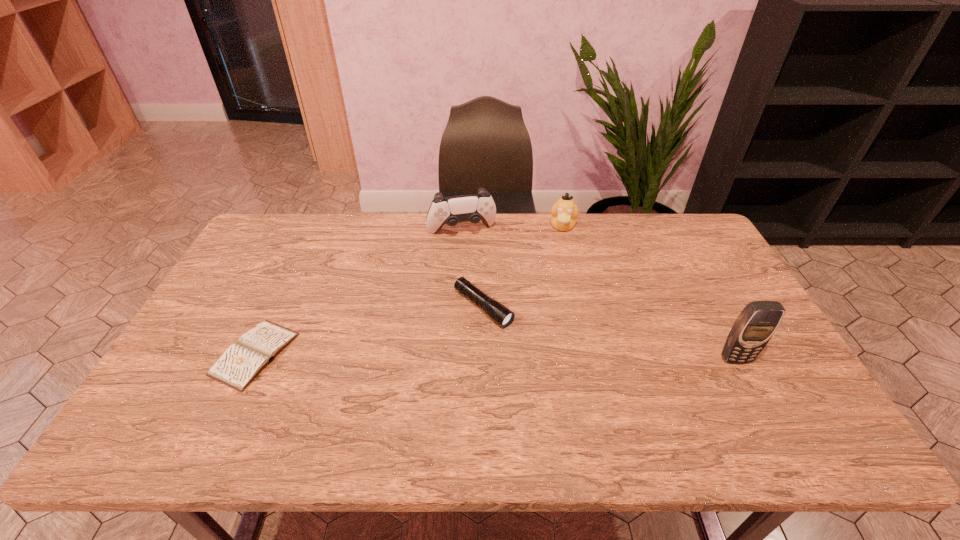
Locate an element on the screen. the leftmost object is located at coordinates (238, 366).

What are the coordinates of `diary` in the screenshot? It's located at (238, 366).

The image size is (960, 540). Identify the location of the rightmost object. (756, 324).

This screenshot has height=540, width=960. I want to click on the tallest object, so click(756, 324).

The width and height of the screenshot is (960, 540). What are the coordinates of `flashlight` in the screenshot? It's located at (499, 313).

Image resolution: width=960 pixels, height=540 pixels. Identify the location of control. point(472,208).

This screenshot has height=540, width=960. In order to click on the second object from right to left in this screenshot , I will do pos(564,212).

The image size is (960, 540). In order to click on the third shortest object in this screenshot , I will do `click(564, 212)`.

Where is `vacant space positioned on the back of the leftmost object`? vacant space positioned on the back of the leftmost object is located at coordinates (311, 236).

Where is `vacant area located on the front face of the cellular telephone`? This screenshot has width=960, height=540. vacant area located on the front face of the cellular telephone is located at coordinates (755, 396).